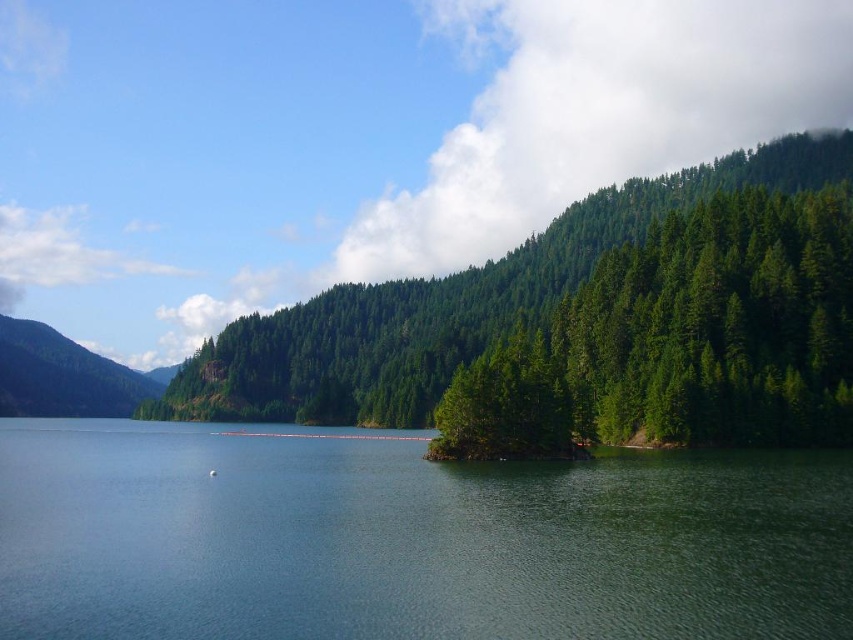
Who is positioned more to the left, green matte tree at center or green forested mountain at left?

From the viewer's perspective, green forested mountain at left appears more on the left side.

Between point (538, 273) and point (142, 388), which one is positioned behind?

Positioned behind is point (142, 388).

Locate an element on the screen. green matte tree at center is located at coordinates (451, 300).

Does point (747, 273) come behind point (354, 321)?

That is False.

Looking at this image, between green matte trees at right and green matte tree at center, which one appears on the right side from the viewer's perspective?

green matte trees at right

Where is `green matte trees at right`? This screenshot has width=853, height=640. green matte trees at right is located at coordinates (679, 340).

Is green smooth water at center taller than green matte tree at center?

In fact, green smooth water at center may be shorter than green matte tree at center.

What do you see at coordinates (408, 540) in the screenshot? The height and width of the screenshot is (640, 853). I see `green smooth water at center` at bounding box center [408, 540].

Locate an element on the screen. green smooth water at center is located at coordinates (408, 540).